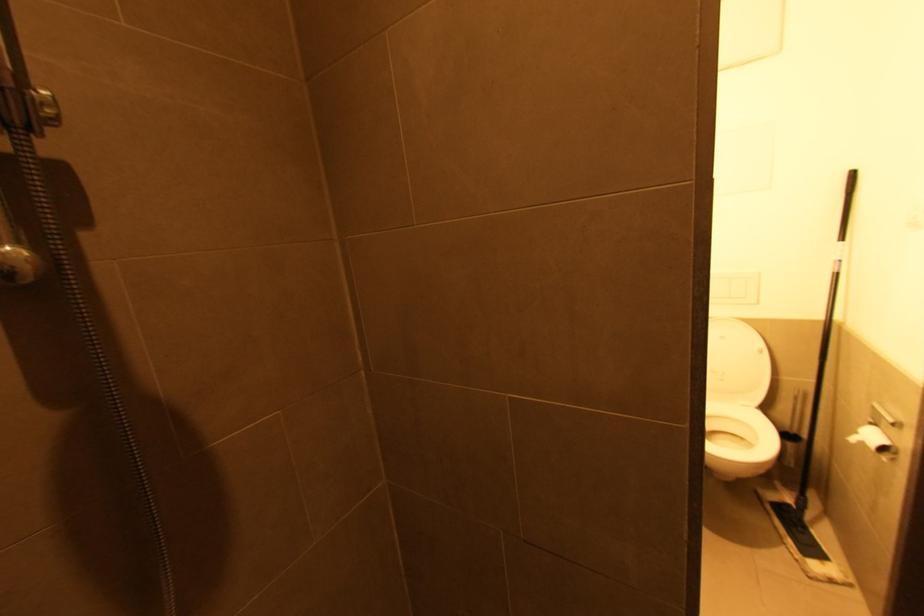
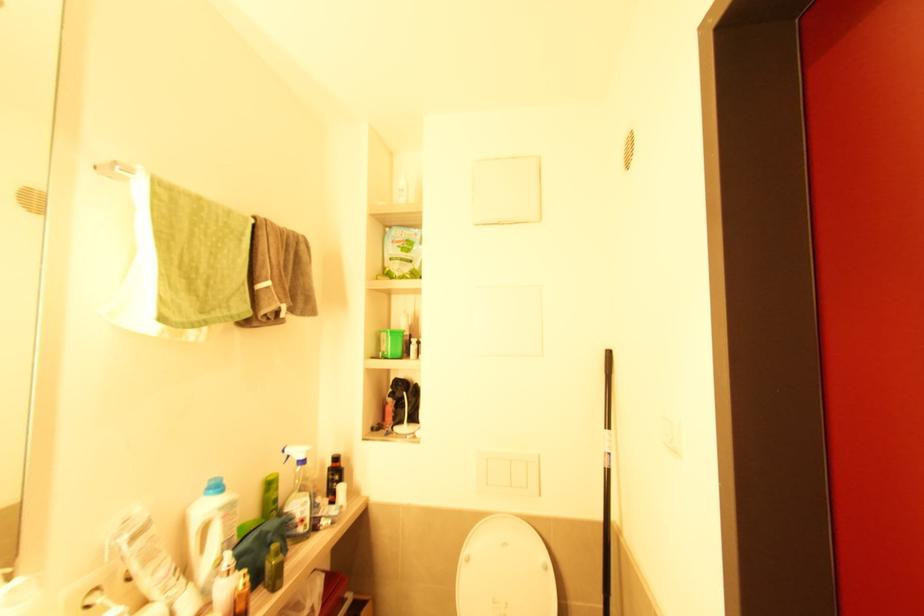
Where in the second image is the point corresponding to (839,277) from the first image?

(610, 472)